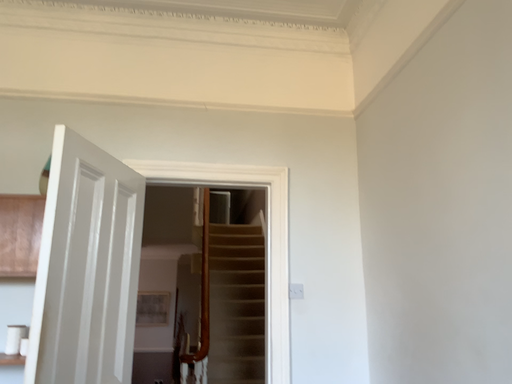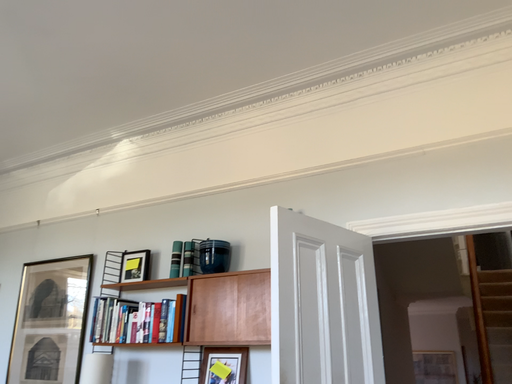
Question: How did the camera likely rotate when shooting the video?

Choices:
 (A) rotated left
 (B) rotated right

Answer: (A)